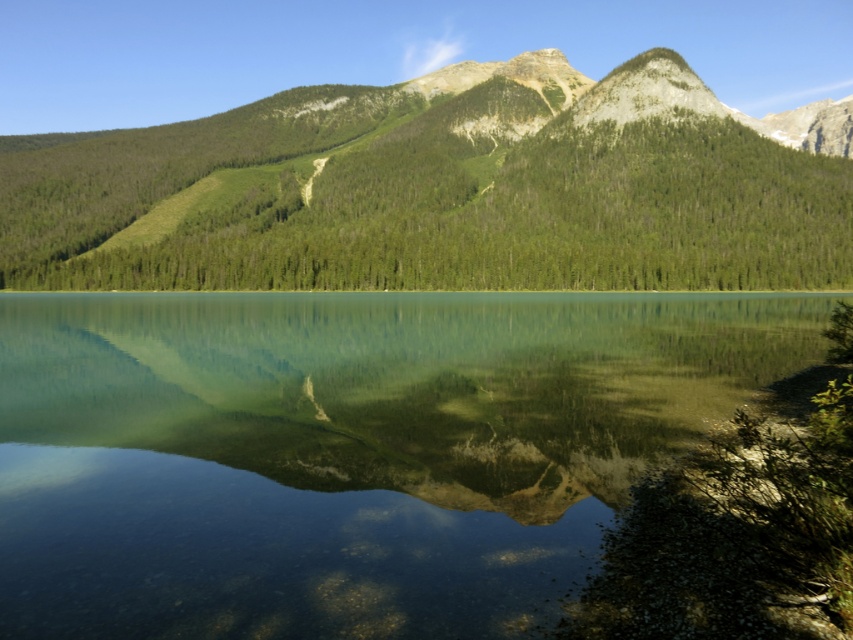
Can you confirm if green glassy water at center is thinner than green textured mountain range at upper center?

Yes, green glassy water at center is thinner than green textured mountain range at upper center.

Which is more to the left, green glassy water at center or green textured mountain range at upper center?

green glassy water at center is more to the left.

Between point (310, 326) and point (296, 113), which one is positioned behind?

The point (296, 113) is more distant.

This screenshot has height=640, width=853. Find the location of `green glassy water at center`. green glassy water at center is located at coordinates (347, 451).